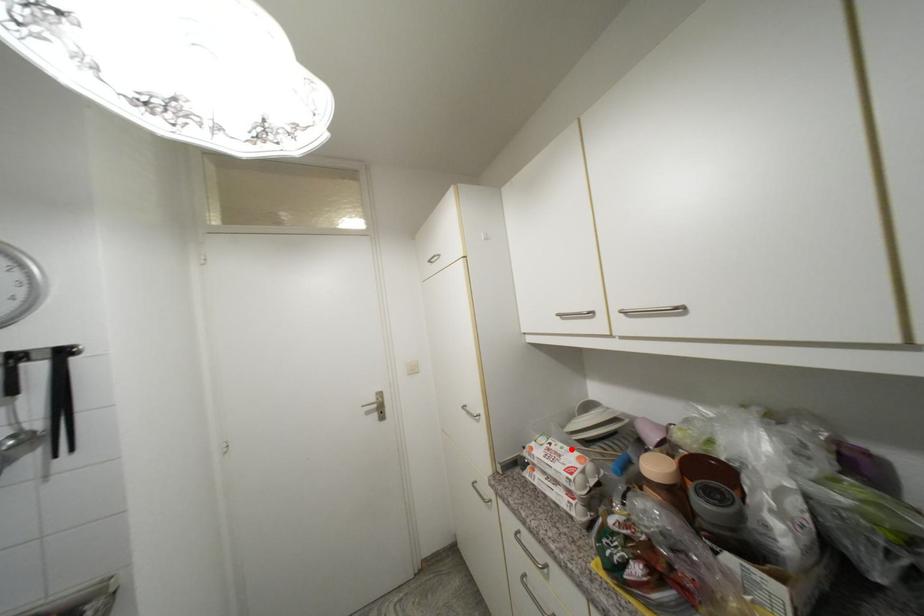
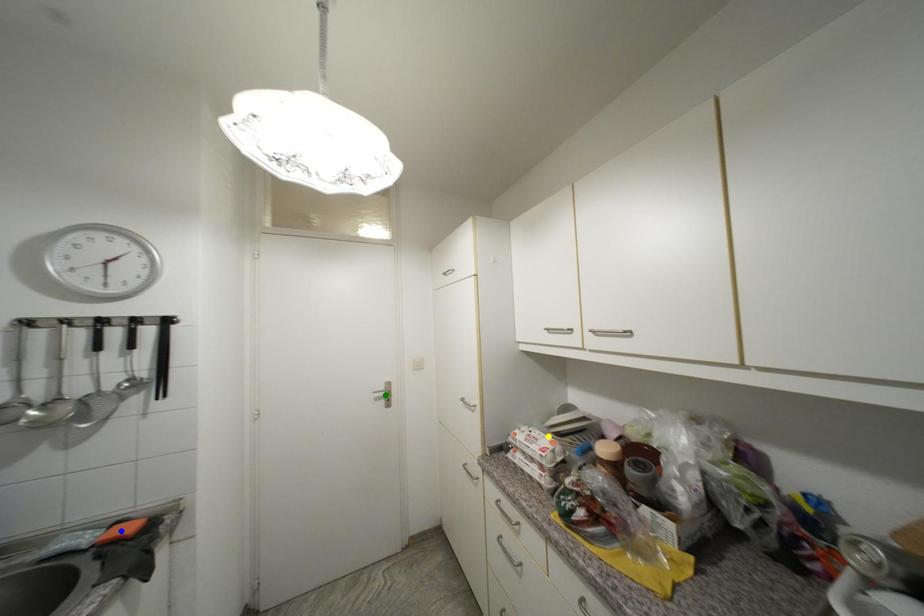
Question: I am providing you with two images of the same scene from different viewpoints. A red point is marked on the first image. You are given multiple points on the second image. Which point in image 2 is actually the same real-world point as the red point in image 1?

Choices:
 (A) yellow point
 (B) blue point
 (C) green point

Answer: (A)